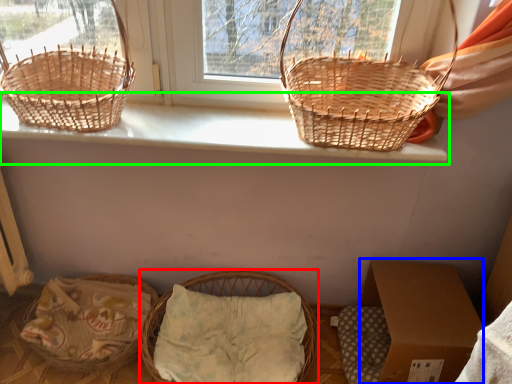
Question: Considering the real-world distances, which object is farthest from picnic basket (highlighted by a red box)? cardboard box (highlighted by a blue box) or window sill (highlighted by a green box)?

Choices:
 (A) cardboard box
 (B) window sill

Answer: (B)